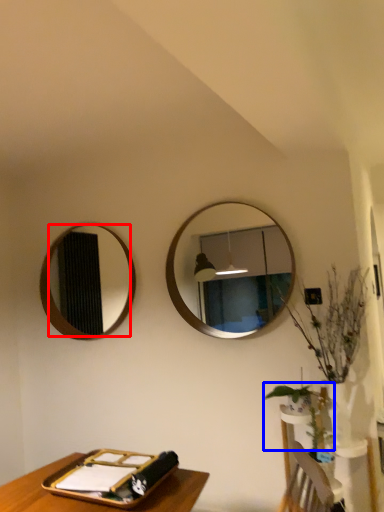
Question: Which object is further to the camera taking this photo, mirror (highlighted by a red box) or plant (highlighted by a blue box)?

Choices:
 (A) mirror
 (B) plant

Answer: (A)